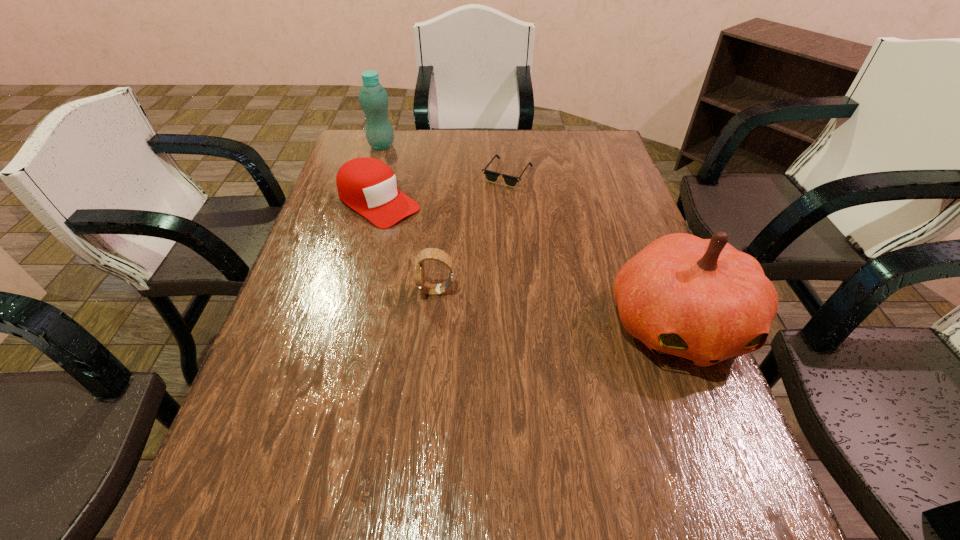
The height and width of the screenshot is (540, 960). What are the coordinates of `free space at the far right corner of the desktop` in the screenshot? It's located at (575, 145).

The width and height of the screenshot is (960, 540). Find the location of `free space at the near right corner of the desktop`. free space at the near right corner of the desktop is located at coordinates (700, 442).

This screenshot has height=540, width=960. What are the coordinates of `free space between the rightmost object and the baseball cap` in the screenshot? It's located at (528, 264).

This screenshot has height=540, width=960. In order to click on free space between the pumpkin and the shortest object in this screenshot , I will do `click(592, 249)`.

At what (x,y) coordinates should I click in order to perform the action: click on empty space that is in between the baseball cap and the rightmost object. Please return your answer as a coordinate pair (x, y). This screenshot has height=540, width=960. Looking at the image, I should click on (528, 264).

Find the location of `unoccupied area between the baseball cap and the second object from right to left`. unoccupied area between the baseball cap and the second object from right to left is located at coordinates (444, 188).

Locate an element on the screen. The width and height of the screenshot is (960, 540). free space that is in between the water bottle and the shortest object is located at coordinates (444, 160).

This screenshot has height=540, width=960. Find the location of `unoccupied area between the watch and the second object from right to left`. unoccupied area between the watch and the second object from right to left is located at coordinates (472, 232).

Locate an element on the screen. The image size is (960, 540). vacant space in between the baseball cap and the pumpkin is located at coordinates (528, 264).

Locate an element on the screen. The width and height of the screenshot is (960, 540). free space between the water bottle and the pumpkin is located at coordinates (530, 235).